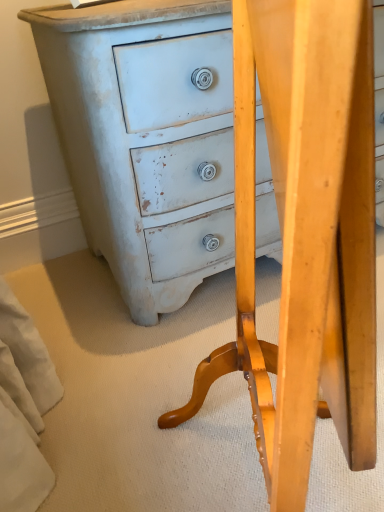
This screenshot has width=384, height=512. What do you see at coordinates (145, 136) in the screenshot? I see `distressed white wood chest of drawers at center` at bounding box center [145, 136].

Measure the distance between point (179, 93) and camera.

Point (179, 93) and camera are 38.58 inches apart from each other.

The height and width of the screenshot is (512, 384). I want to click on distressed white wood chest of drawers at center, so click(145, 136).

Where is `distressed white wood chest of drawers at center`? distressed white wood chest of drawers at center is located at coordinates (145, 136).